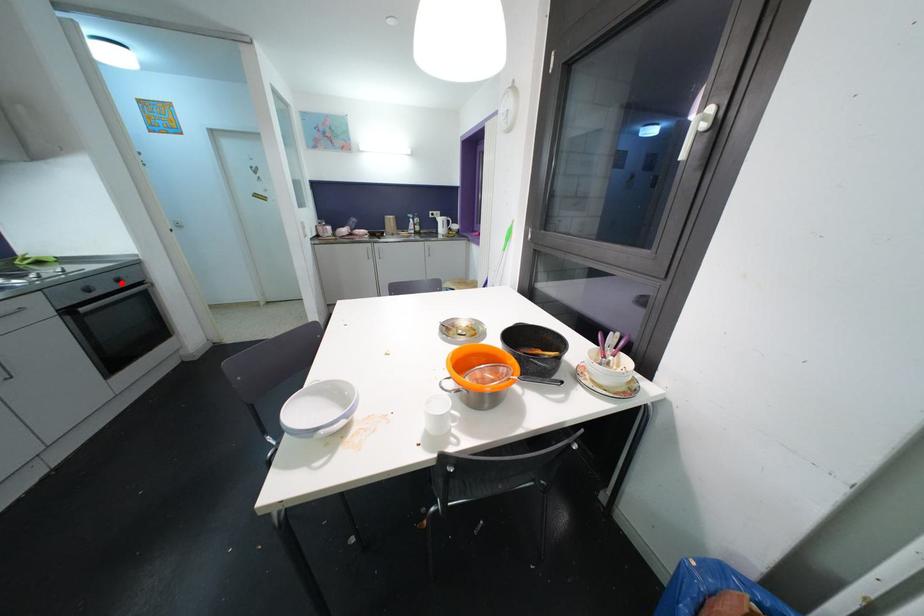
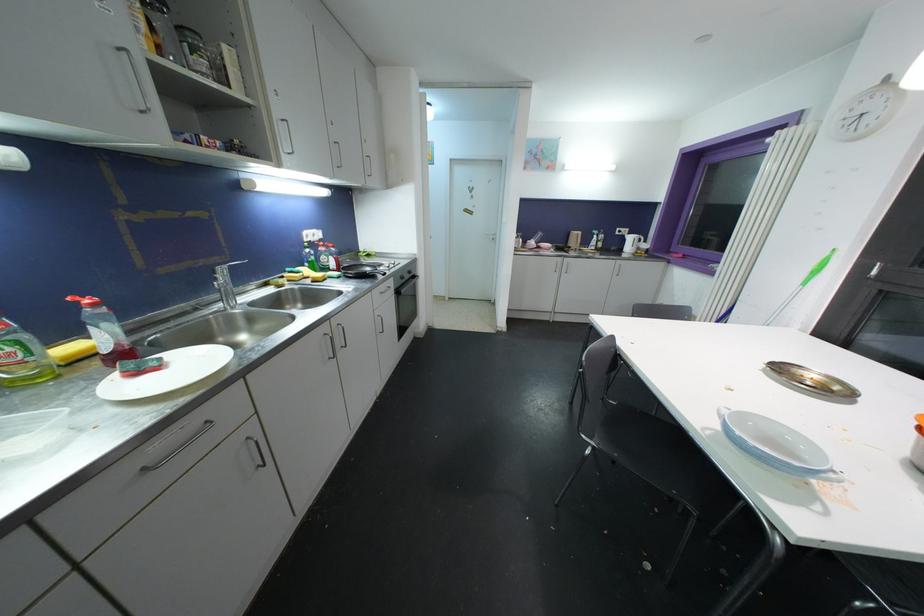
Question: I am providing you with two images of the same scene from different viewpoints. Given a red point in image1, look at the same physical point in image2. Is it:

Choices:
 (A) Closer to the viewpoint
 (B) Farther from the viewpoint

Answer: (A)